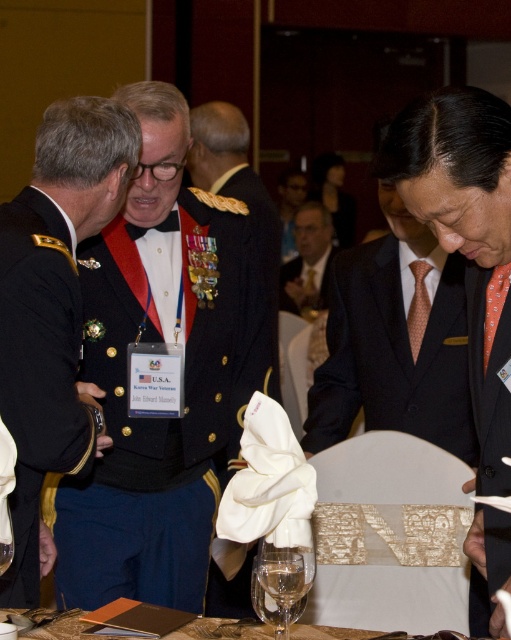
Does point (268, 618) come closer to viewer compared to point (298, 307)?

Yes, point (268, 618) is in front of point (298, 307).

Is clear glass wine glass at lower center above smooth gold tie at center?

No.

Does point (292, 577) lie behind point (329, 236)?

No, (292, 577) is in front of (329, 236).

You are a GUI agent. You are given a task and a screenshot of the screen. Output one action in this format:
    pyautogui.click(x=<x>, y=<y>)
    Task: Click on the clear glass wine glass at lower center
    This screenshot has height=640, width=511.
    Given the screenshot: What is the action you would take?
    pyautogui.click(x=281, y=584)

The width and height of the screenshot is (511, 640). What do you see at coordinates (183, 392) in the screenshot?
I see `shiny black fabric at center` at bounding box center [183, 392].

What do you see at coordinates (183, 392) in the screenshot? This screenshot has width=511, height=640. I see `shiny black fabric at center` at bounding box center [183, 392].

Where is `shiny black fabric at center`? This screenshot has width=511, height=640. shiny black fabric at center is located at coordinates (183, 392).

Which is in front, point (234, 161) or point (500, 225)?

Positioned in front is point (500, 225).

Does gold textured epaulets at upper center have a greater height compared to orange dotted tie at right?

Correct, gold textured epaulets at upper center is much taller as orange dotted tie at right.

Between point (222, 108) and point (464, 252), which one is positioned behind?

The point (222, 108) is more distant.

Locate an element on the screen. The image size is (511, 640). gold textured epaulets at upper center is located at coordinates (228, 163).